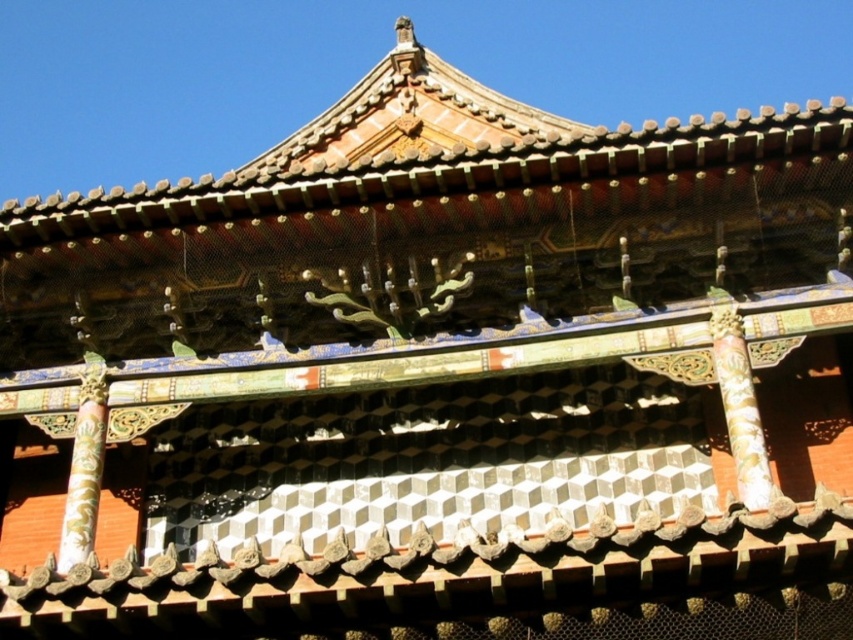
Who is lower down, gold-carved wooden pillar at center or gold-painted wood pillar at center-left?

gold-painted wood pillar at center-left is lower down.

Between point (762, 433) and point (90, 390), which one is positioned behind?

Positioned behind is point (90, 390).

Is point (734, 394) positioned in front of point (59, 552)?

That is True.

The height and width of the screenshot is (640, 853). I want to click on gold-carved wooden pillar at center, so click(740, 403).